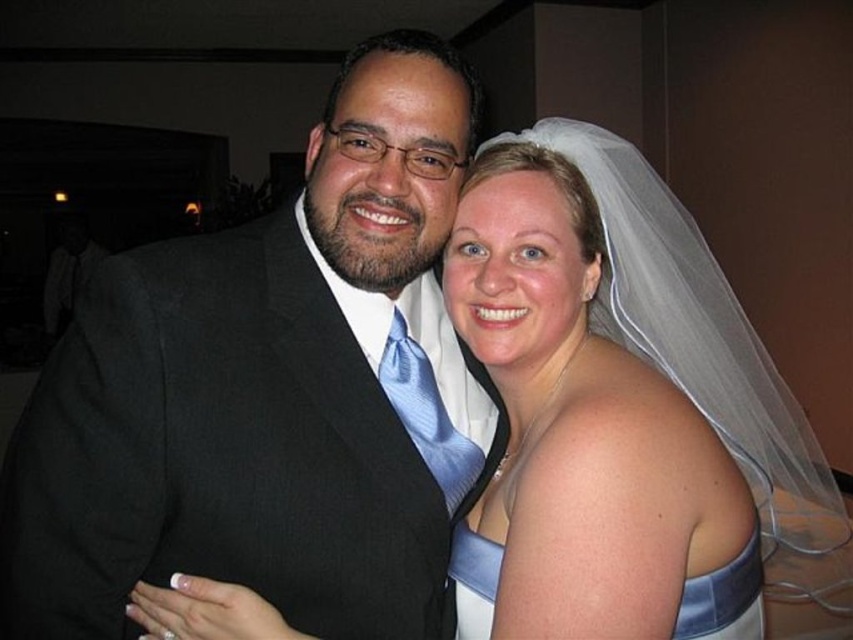
Question: Does black suit at center come in front of white satin dress at lower right?

Choices:
 (A) no
 (B) yes

Answer: (A)

Question: Estimate the real-world distances between objects in this image. Which object is closer to the white satin dress at center?

Choices:
 (A) black suit at center
 (B) white satin dress at lower right

Answer: (B)

Question: Which of the following is the farthest from the observer?

Choices:
 (A) white satin dress at center
 (B) white satin dress at lower right

Answer: (B)

Question: Can you confirm if white satin dress at center is wider than white satin dress at lower right?

Choices:
 (A) no
 (B) yes

Answer: (B)

Question: Which object is farther from the camera taking this photo?

Choices:
 (A) white satin dress at lower right
 (B) white satin dress at center

Answer: (A)

Question: Is black suit at center to the left of white satin dress at lower right from the viewer's perspective?

Choices:
 (A) no
 (B) yes

Answer: (B)